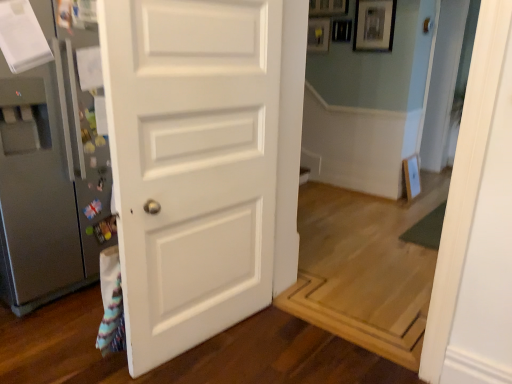
Question: Is satin silver refrigerator at left smaller than silver metallic door handle at center?

Choices:
 (A) no
 (B) yes

Answer: (A)

Question: Is satin silver refrigerator at left thinner than silver metallic door handle at center?

Choices:
 (A) yes
 (B) no

Answer: (B)

Question: Does satin silver refrigerator at left lie in front of silver metallic door handle at center?

Choices:
 (A) yes
 (B) no

Answer: (A)

Question: Is satin silver refrigerator at left to the left of silver metallic door handle at center from the viewer's perspective?

Choices:
 (A) yes
 (B) no

Answer: (A)

Question: Can you confirm if satin silver refrigerator at left is taller than silver metallic door handle at center?

Choices:
 (A) no
 (B) yes

Answer: (B)

Question: Is satin silver refrigerator at left outside silver metallic door handle at center?

Choices:
 (A) yes
 (B) no

Answer: (A)

Question: Is satin silver refrigerator at left bigger than white matte door at center?

Choices:
 (A) yes
 (B) no

Answer: (A)

Question: Is satin silver refrigerator at left facing towards white matte door at center?

Choices:
 (A) yes
 (B) no

Answer: (A)

Question: Is satin silver refrigerator at left looking in the opposite direction of white matte door at center?

Choices:
 (A) yes
 (B) no

Answer: (B)

Question: Considering the relative sizes of satin silver refrigerator at left and white matte door at center in the image provided, is satin silver refrigerator at left thinner than white matte door at center?

Choices:
 (A) yes
 (B) no

Answer: (B)

Question: Is white matte door at center completely or partially inside satin silver refrigerator at left?

Choices:
 (A) no
 (B) yes

Answer: (A)

Question: Can we say satin silver refrigerator at left lies outside white matte door at center?

Choices:
 (A) no
 (B) yes

Answer: (B)

Question: Is silver metallic door handle at center to the right of matte black picture frame at upper center from the viewer's perspective?

Choices:
 (A) yes
 (B) no

Answer: (A)